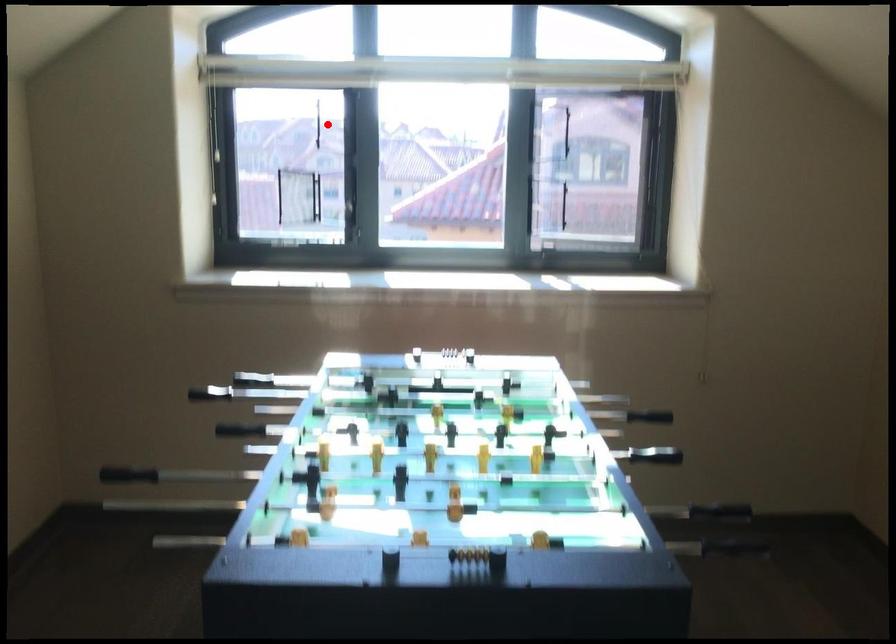
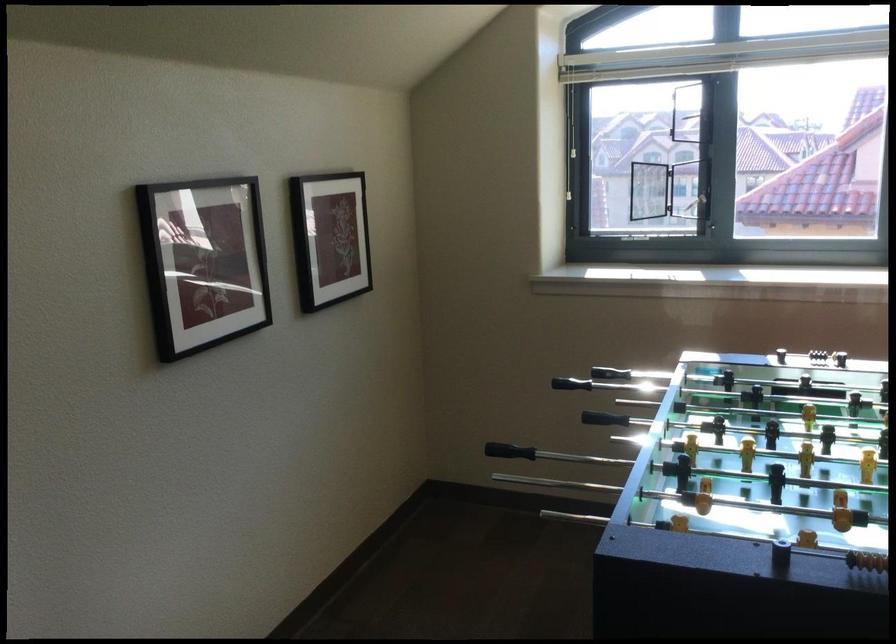
The point at the highlighted location is marked in the first image. Where is the corresponding point in the second image?

(692, 116)